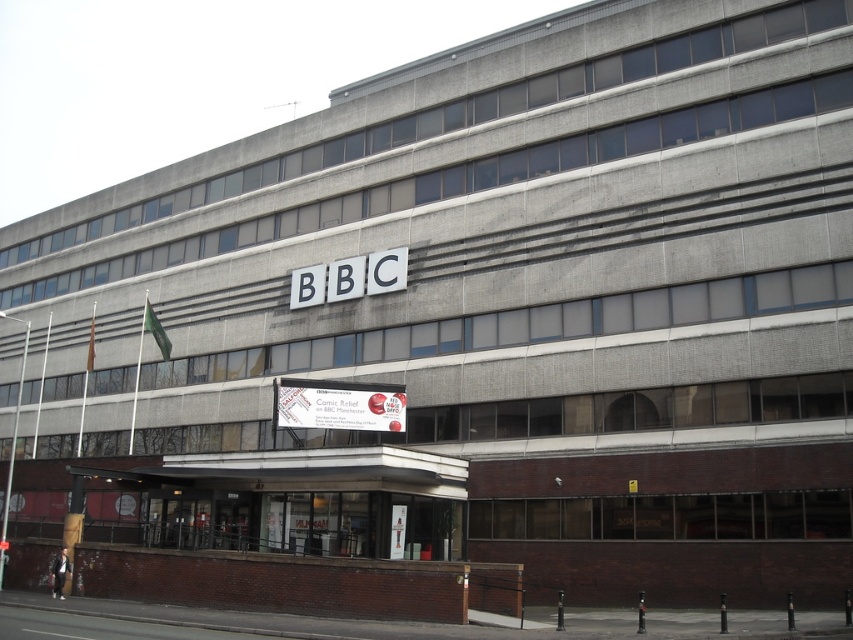
Question: Does white plastic sign at center appear over white plastic bbc sign at center?

Choices:
 (A) yes
 (B) no

Answer: (B)

Question: Can you confirm if white plastic sign at center is bigger than white plastic bbc sign at center?

Choices:
 (A) no
 (B) yes

Answer: (B)

Question: Which point appears closest to the camera in this image?

Choices:
 (A) (393, 266)
 (B) (309, 381)

Answer: (B)

Question: Can you confirm if white plastic sign at center is positioned to the left of white plastic bbc sign at center?

Choices:
 (A) yes
 (B) no

Answer: (A)

Question: Which object appears closest to the camera in this image?

Choices:
 (A) white plastic bbc sign at center
 (B) white plastic sign at center

Answer: (B)

Question: Which object appears closest to the camera in this image?

Choices:
 (A) white plastic bbc sign at center
 (B) white plastic sign at center

Answer: (B)